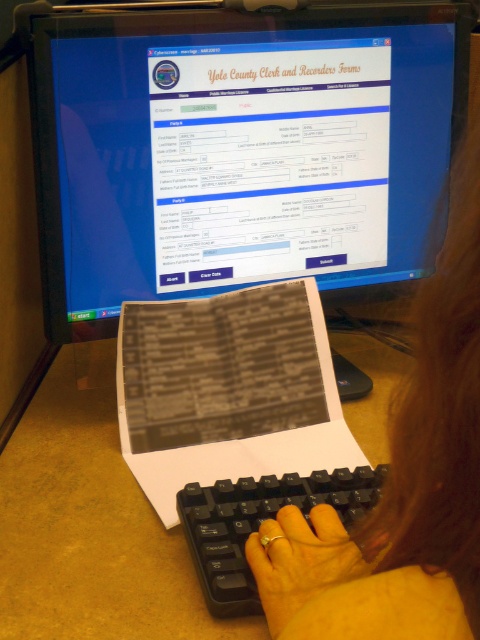
Question: Can you confirm if matte black monitor at upper center is smaller than gold metallic ring at center?

Choices:
 (A) yes
 (B) no

Answer: (B)

Question: Is black plastic keyboard at center thinner than gold metallic ring at center?

Choices:
 (A) no
 (B) yes

Answer: (A)

Question: Which is nearer to the matte black monitor at upper center?

Choices:
 (A) yellow matte paper at center
 (B) black plastic keyboard at center

Answer: (A)

Question: Considering the real-world distances, which object is farthest from the gold metallic ring at center?

Choices:
 (A) matte black monitor at upper center
 (B) yellow matte paper at center

Answer: (A)

Question: Estimate the real-world distances between objects in this image. Which object is closer to the gold metallic ring at center?

Choices:
 (A) matte black monitor at upper center
 (B) yellow matte paper at center

Answer: (B)

Question: Is matte black monitor at upper center above black plastic keyboard at center?

Choices:
 (A) yes
 (B) no

Answer: (A)